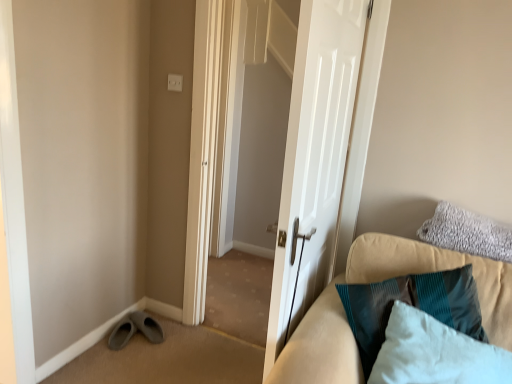
Question: In terms of size, does white glossy door at center appear bigger or smaller than teal fabric couch at right?

Choices:
 (A) big
 (B) small

Answer: (A)

Question: From the image's perspective, is white glossy door at center located above or below teal fabric couch at right?

Choices:
 (A) above
 (B) below

Answer: (A)

Question: Which object is the closest to the teal fabric couch at right?

Choices:
 (A) white glossy door at center
 (B) gray fluffy pillow at upper right, placed as the 2th pillow when sorted from front to back
 (C) white glossy door at center
 (D) white soft pillow at lower right, the 1th pillow viewed from the front
 (E) gray suede shoe at lower left

Answer: (D)

Question: Estimate the real-world distances between objects in this image. Which object is closer to the gray fluffy pillow at upper right, the first pillow from the back?

Choices:
 (A) white glossy door at center
 (B) gray suede shoe at lower left
 (C) white soft pillow at lower right, marked as the first pillow in a bottom-to-top arrangement
 (D) teal fabric couch at right
 (E) white glossy door at center

Answer: (D)